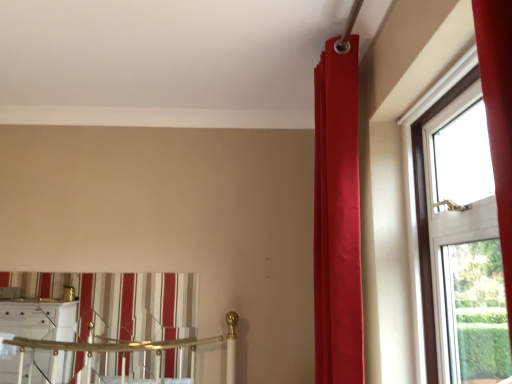
Question: In terms of size, does striped fabric curtain at lower left, the second curtain viewed from the front, appear bigger or smaller than satin red curtain at upper right, marked as the second curtain in a back-to-front arrangement?

Choices:
 (A) small
 (B) big

Answer: (A)

Question: In terms of width, does striped fabric curtain at lower left, placed as the first curtain when sorted from back to front, look wider or thinner when compared to satin red curtain at upper right, which ranks as the first curtain in right-to-left order?

Choices:
 (A) wide
 (B) thin

Answer: (B)

Question: Based on their relative distances, which object is nearer to the satin red curtain at upper right, marked as the 2th curtain in a left-to-right arrangement?

Choices:
 (A) transparent glass window at right
 (B) striped fabric curtain at lower left, the second curtain viewed from the front

Answer: (A)

Question: Considering the real-world distances, which object is closest to the striped fabric curtain at lower left, which is the 1th curtain from left to right?

Choices:
 (A) transparent glass window at right
 (B) satin red curtain at upper right, which ranks as the first curtain in right-to-left order

Answer: (B)